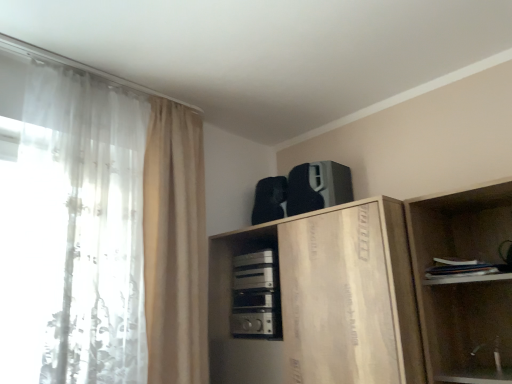
Question: From a real-world perspective, is white sheer curtain at left, acting as the second curtain starting from the right, above or below wooden cabinet at upper center?

Choices:
 (A) below
 (B) above

Answer: (B)

Question: Is white sheer curtain at left, which appears as the first curtain when viewed from the left, taller or shorter than wooden cabinet at upper center?

Choices:
 (A) short
 (B) tall

Answer: (B)

Question: Which of these objects is positioned closest to the wooden cabinet at upper center?

Choices:
 (A) satin silver appliance at center, positioned as the 1th appliance in bottom-to-top order
 (B) white sheer curtain at left, which appears as the first curtain when viewed from the left
 (C) beige fabric curtain at left, which ranks as the second curtain in left-to-right order
 (D) white paper book at right
 (E) black matte speaker at upper center, positioned as the first appliance in top-to-bottom order

Answer: (A)

Question: Which is farther from the white sheer curtain at left, which appears as the first curtain when viewed from the left?

Choices:
 (A) satin silver appliance at center, positioned as the 1th appliance in bottom-to-top order
 (B) wooden cabinet at upper center
 (C) black matte speaker at upper center, marked as the second appliance in a bottom-to-top arrangement
 (D) beige fabric curtain at left, which is counted as the 1th curtain, starting from the right
 (E) white paper book at right

Answer: (E)